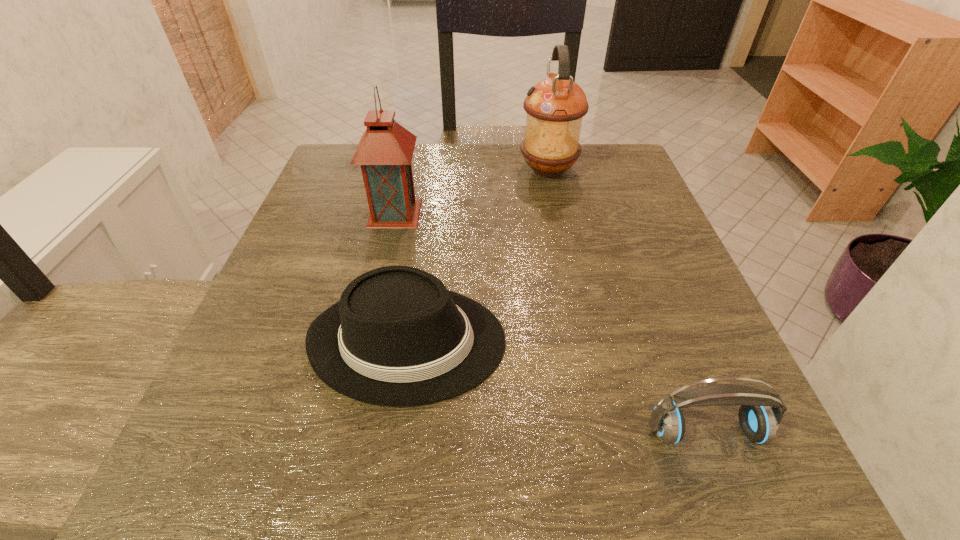
In the image, there is a desktop. Find the location of `free space at the far right corner`. free space at the far right corner is located at coordinates pos(606,178).

Locate an element on the screen. This screenshot has width=960, height=540. free space at the near right corner of the desktop is located at coordinates (697, 444).

Image resolution: width=960 pixels, height=540 pixels. What are the coordinates of `free space that is in between the headset and the third farthest object` in the screenshot? It's located at (557, 387).

This screenshot has width=960, height=540. In order to click on vacant area between the lantern and the headset in this screenshot , I will do `click(550, 322)`.

Identify the location of free point between the farthest object and the fedora. The width and height of the screenshot is (960, 540). (478, 256).

This screenshot has width=960, height=540. In order to click on free space between the farthest object and the fedora in this screenshot , I will do `click(478, 256)`.

Identify the location of empty space between the fedora and the nearest object. (557, 387).

You are a GUI agent. You are given a task and a screenshot of the screen. Output one action in this format:
    pyautogui.click(x=<x>, y=<y>)
    Task: Click on the free area in between the farthest object and the headset
    The height and width of the screenshot is (540, 960).
    Given the screenshot: What is the action you would take?
    pyautogui.click(x=627, y=301)

Locate an element on the screen. free space between the lantern and the farthest object is located at coordinates (471, 192).

Locate an element on the screen. free spot between the farthest object and the lantern is located at coordinates (471, 192).